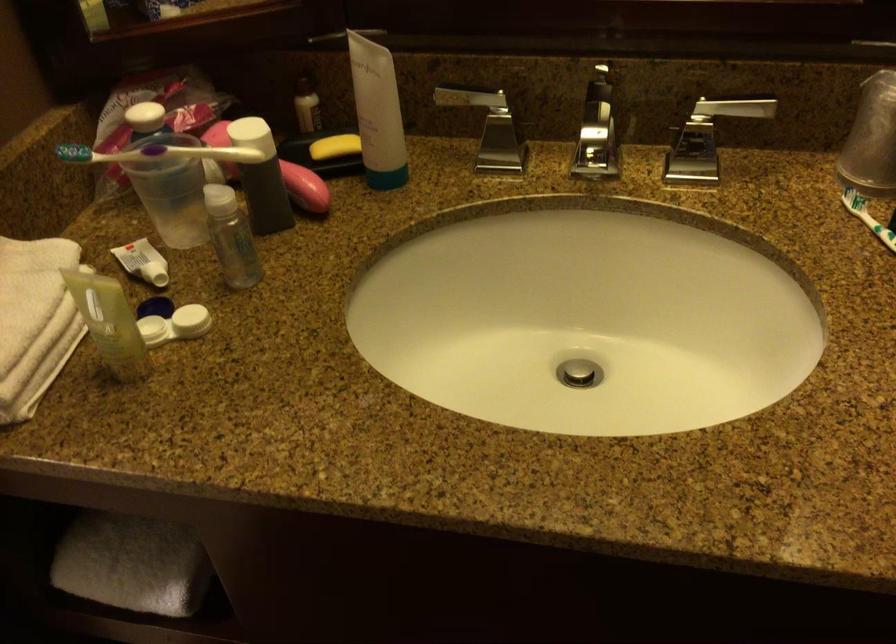
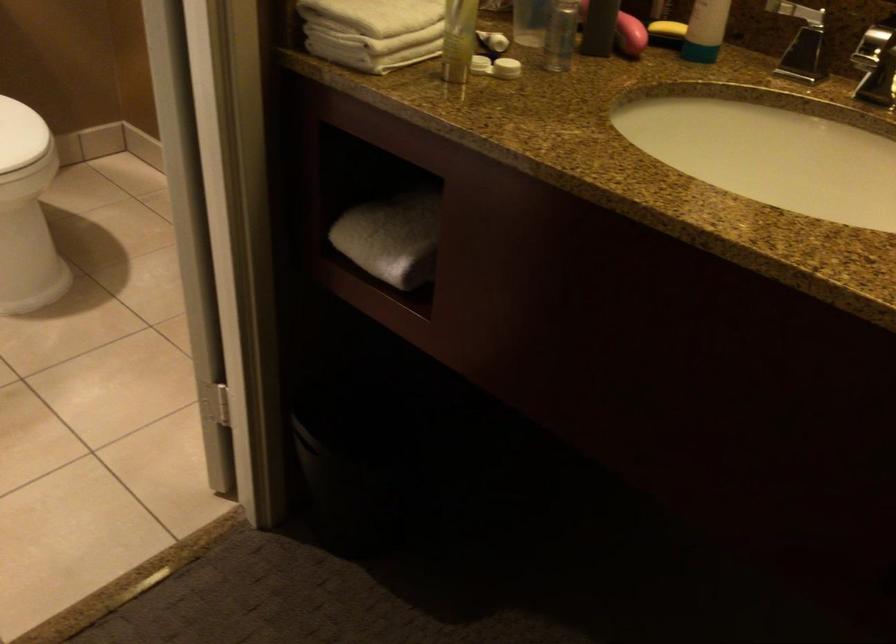
The point at (332,149) is marked in the first image. Where is the corresponding point in the second image?

(667, 29)